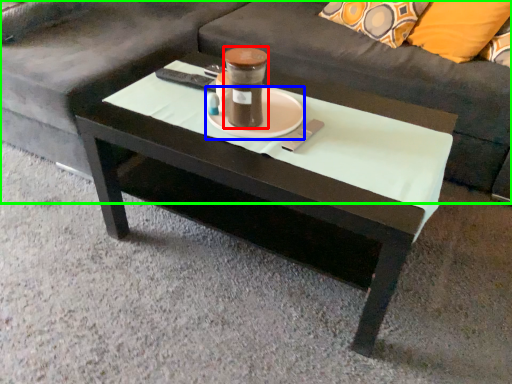
Question: Which is nearer to the beverage (highlighted by a red box)? saucer (highlighted by a blue box) or studio couch (highlighted by a green box).

Choices:
 (A) saucer
 (B) studio couch

Answer: (A)